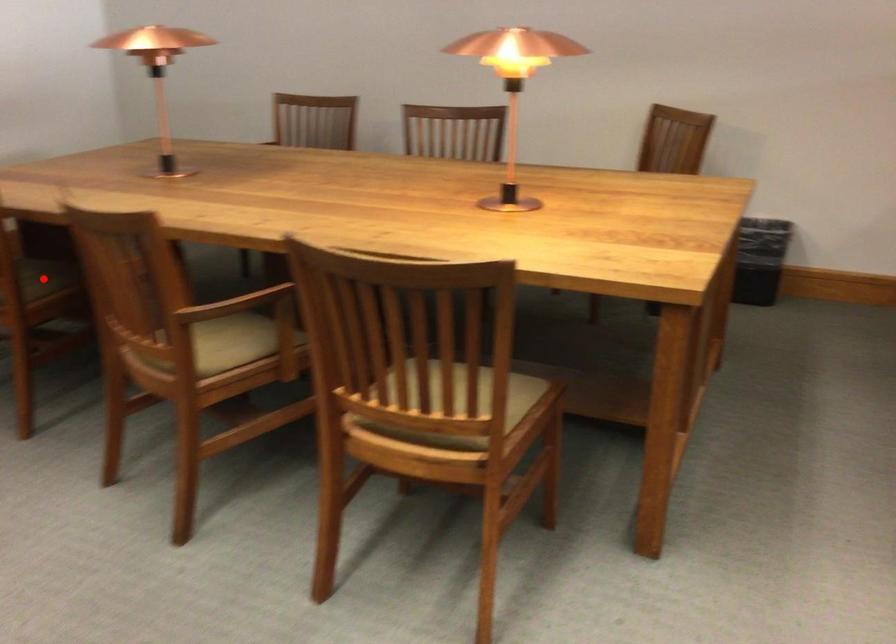
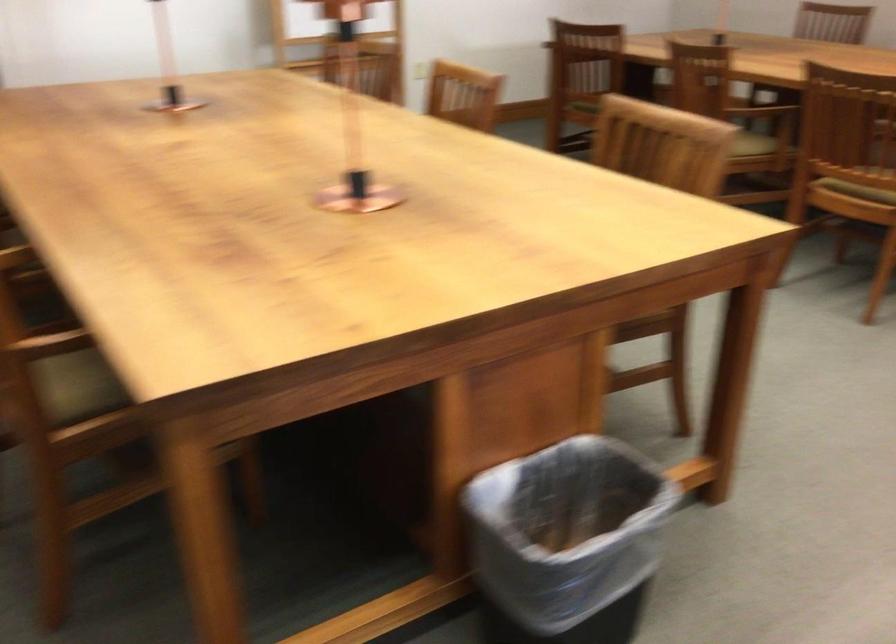
Question: I am providing you with two images of the same scene from different viewpoints. A red point is marked on the first image. At the location where the point appears in image 1, is it still visible in image 2?

Choices:
 (A) Yes
 (B) No

Answer: (B)